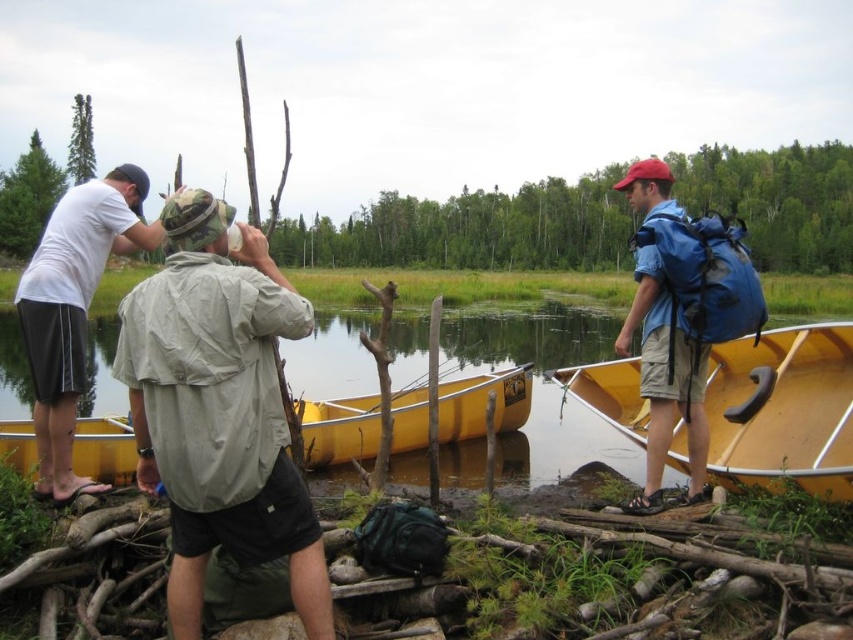
Between yellow wood water at center and yellow wood boat at right, which one appears on the left side from the viewer's perspective?

yellow wood water at center

In the scene shown: Is yellow wood water at center bigger than yellow wood boat at right?

Yes, yellow wood water at center is bigger than yellow wood boat at right.

The width and height of the screenshot is (853, 640). What do you see at coordinates (550, 385) in the screenshot?
I see `yellow wood water at center` at bounding box center [550, 385].

Find the location of a particular element. This screenshot has height=640, width=853. yellow wood water at center is located at coordinates (550, 385).

Which of these two, blue fabric backpack at center or black rubber paddle at right, stands taller?

With more height is blue fabric backpack at center.

Does point (651, 376) lie behind point (755, 376)?

No, it is in front of (755, 376).

You are a GUI agent. You are given a task and a screenshot of the screen. Output one action in this format:
    pyautogui.click(x=<x>, y=<y>)
    Task: Click on the blue fabric backpack at center
    The image size is (853, 640).
    Given the screenshot: What is the action you would take?
    pyautogui.click(x=665, y=385)

Is khaki fabric shirt at center to the right of blue fabric backpack at center from the viewer's perspective?

In fact, khaki fabric shirt at center is to the left of blue fabric backpack at center.

Does khaki fabric shirt at center have a greater height compared to blue fabric backpack at center?

In fact, khaki fabric shirt at center may be shorter than blue fabric backpack at center.

Does point (231, 547) come farther from viewer compared to point (675, 404)?

No, (231, 547) is in front of (675, 404).

This screenshot has width=853, height=640. In order to click on khaki fabric shirt at center in this screenshot , I will do `click(219, 408)`.